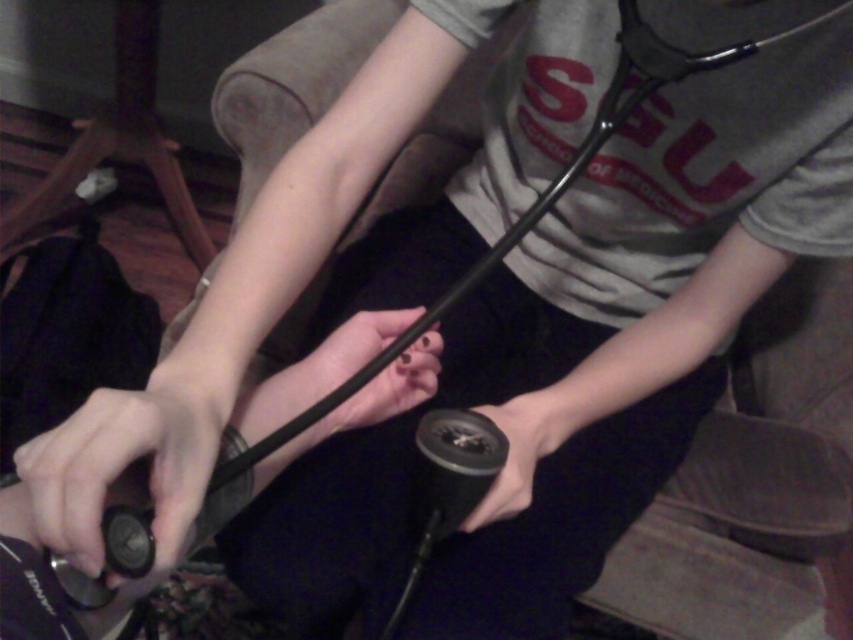
Question: Which point is closer to the camera?

Choices:
 (A) (47, 509)
 (B) (509, 504)
 (C) (379, 342)

Answer: (A)

Question: Is matte black wristwatch at lower left smaller than black matte cable at center?

Choices:
 (A) no
 (B) yes

Answer: (B)

Question: Considering the real-world distances, which object is farthest from the black rubber grip at center?

Choices:
 (A) matte black wristwatch at lower left
 (B) black matte cable at center

Answer: (A)

Question: Can you confirm if matte black wristwatch at lower left is positioned below black matte cable at center?

Choices:
 (A) yes
 (B) no

Answer: (A)

Question: Which point is closer to the camera?

Choices:
 (A) black matte cable at center
 (B) black rubber grip at center

Answer: (A)

Question: Is black matte cable at center thinner than black rubber grip at center?

Choices:
 (A) no
 (B) yes

Answer: (A)